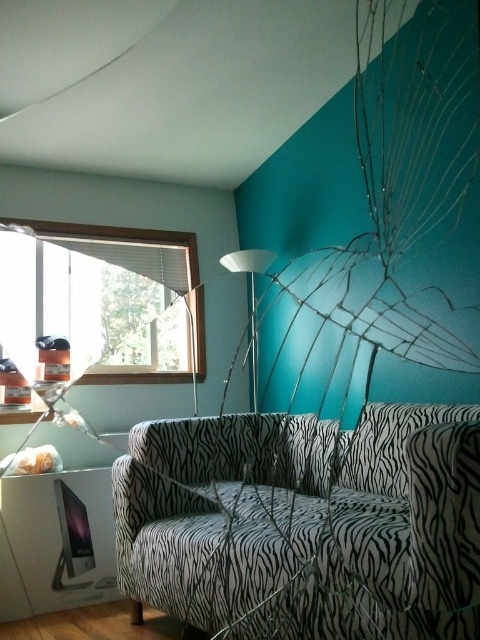
Question: Can you confirm if zebra-patterned fabric couch at center is wider than white glossy floor lamp at center?

Choices:
 (A) yes
 (B) no

Answer: (A)

Question: Among these points, which one is farthest from the camera?

Choices:
 (A) (190, 275)
 (B) (389, 620)

Answer: (A)

Question: Which point is farther to the camera?

Choices:
 (A) (202, 365)
 (B) (273, 595)
 (C) (245, 259)

Answer: (A)

Question: Can you confirm if wooden frame at left is thinner than white glossy floor lamp at center?

Choices:
 (A) no
 (B) yes

Answer: (A)

Question: Which of the following is the closest to the observer?

Choices:
 (A) (192, 545)
 (B) (264, 257)
 (C) (203, 307)

Answer: (A)

Question: Can you confirm if zebra-patterned fabric couch at center is positioned above white glossy floor lamp at center?

Choices:
 (A) yes
 (B) no

Answer: (B)